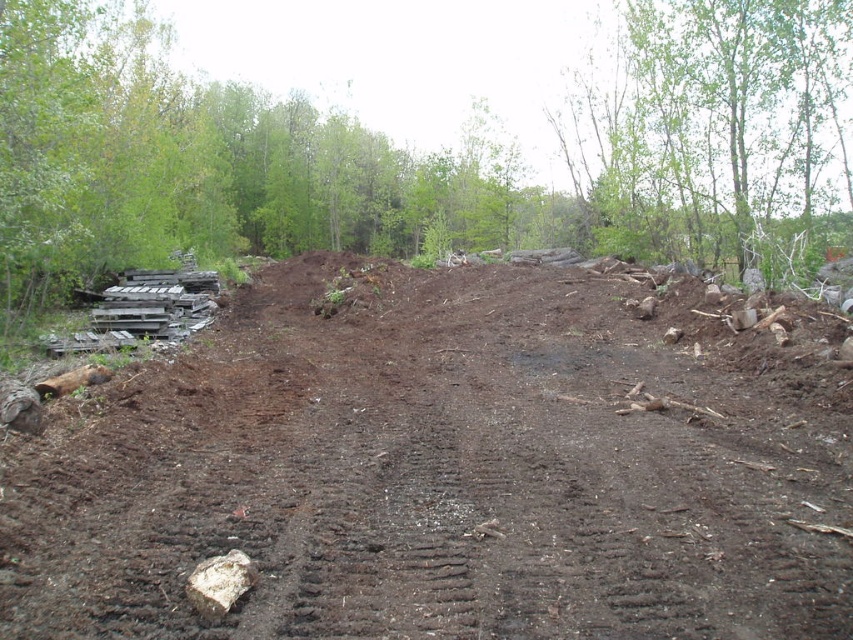
Question: Which is nearer to the white rough rock at lower left?

Choices:
 (A) dark brown soil at center
 (B) green leafy tree at upper right

Answer: (A)

Question: Is dark brown soil at center bigger than white rough rock at lower left?

Choices:
 (A) no
 (B) yes

Answer: (B)

Question: Which object is the farthest from the white rough rock at lower left?

Choices:
 (A) dark brown soil at center
 (B) green leafy tree at upper right

Answer: (B)

Question: Estimate the real-world distances between objects in this image. Which object is farther from the white rough rock at lower left?

Choices:
 (A) dark brown soil at center
 (B) green leafy tree at upper right

Answer: (B)

Question: Can you confirm if dark brown soil at center is thinner than green leafy tree at upper right?

Choices:
 (A) no
 (B) yes

Answer: (A)

Question: Can you confirm if dark brown soil at center is positioned to the right of green leafy tree at upper right?

Choices:
 (A) yes
 (B) no

Answer: (B)